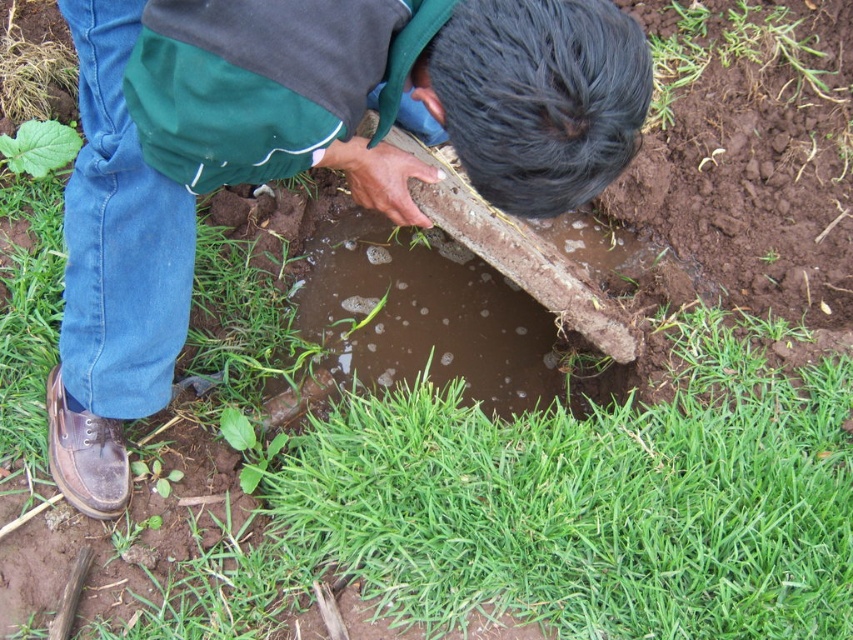
Question: Observing the image, what is the correct spatial positioning of brown clay shovel at center in reference to green grass at lower center?

Choices:
 (A) right
 (B) left

Answer: (B)

Question: Does brown clay shovel at center lie behind green grass at lower center?

Choices:
 (A) yes
 (B) no

Answer: (B)

Question: Which object is closer to the camera taking this photo?

Choices:
 (A) green grass at lower center
 (B) brown clay shovel at center

Answer: (B)

Question: In this image, where is brown clay shovel at center located relative to green grass at lower center?

Choices:
 (A) below
 (B) above

Answer: (B)

Question: Which of the following is the closest to the observer?

Choices:
 (A) green grass at lower center
 (B) brown clay shovel at center

Answer: (B)

Question: Which object appears farthest from the camera in this image?

Choices:
 (A) brown clay shovel at center
 (B) green grass at lower center

Answer: (B)